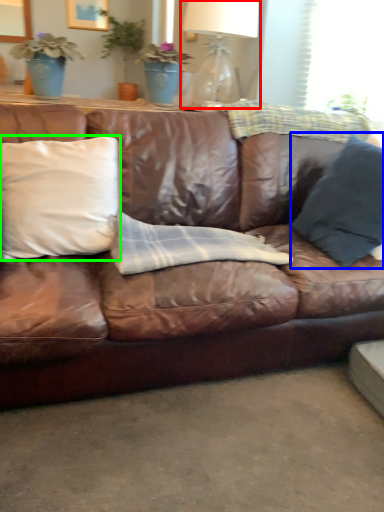
Question: Considering the real-world distances, which object is farthest from table lamp (highlighted by a red box)? pillow (highlighted by a blue box) or pillow (highlighted by a green box)?

Choices:
 (A) pillow
 (B) pillow

Answer: (B)